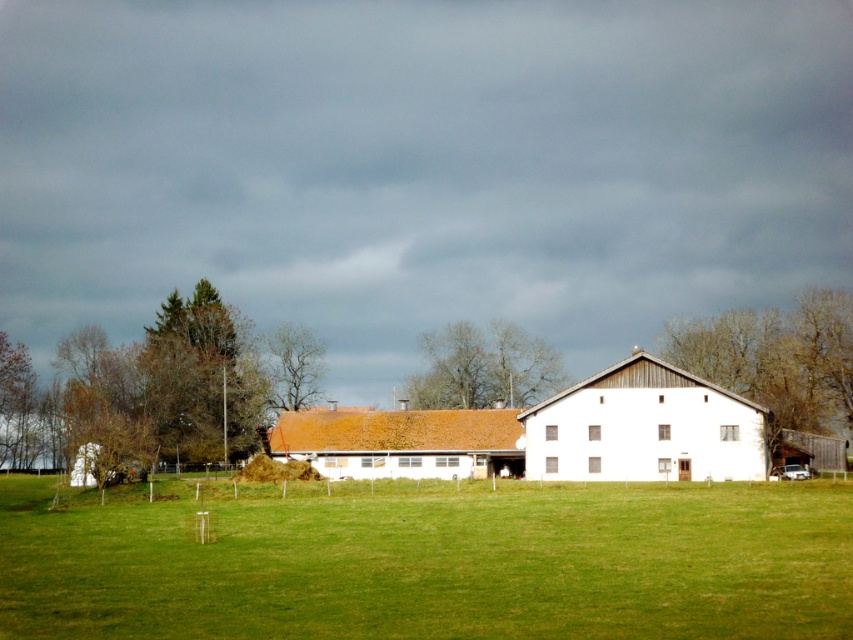
Which is in front, point (682, 461) or point (764, 380)?

Point (682, 461) is more forward.

Where is `white wood barn at center`? This screenshot has width=853, height=640. white wood barn at center is located at coordinates (643, 428).

Is point (483, 596) closer to viewer compared to point (549, 348)?

Yes.

Is point (549, 576) farther from viewer compared to point (410, 404)?

No, (549, 576) is in front of (410, 404).

Locate an element on the screen. The height and width of the screenshot is (640, 853). green grassy field at center is located at coordinates (427, 561).

Is white wood barn at center positioned before green textured tree at left?

Yes, white wood barn at center is closer to the viewer.

Is white wood barn at center above green textured tree at left?

Actually, white wood barn at center is below green textured tree at left.

Does point (619, 369) lie in front of point (248, 445)?

That is True.

I want to click on white wood barn at center, so click(x=643, y=428).